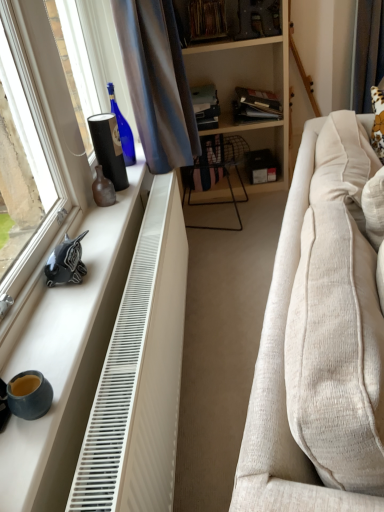
The height and width of the screenshot is (512, 384). Find the location of `vacant area in front of black glossy unicorn at left`. vacant area in front of black glossy unicorn at left is located at coordinates (61, 312).